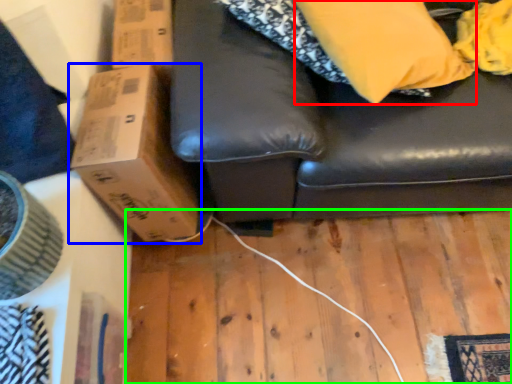
Question: Which object is the farthest from pillow (highlighted by a red box)? Choose among these: cardboard box (highlighted by a blue box) or plywood (highlighted by a green box).

Choices:
 (A) cardboard box
 (B) plywood

Answer: (B)